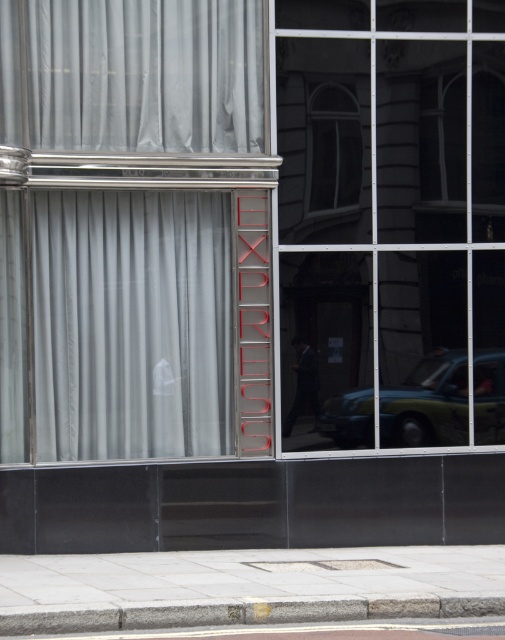
You are standing outside the building and want to see the interior through the windows. Which window, the transparent glass window at center or the clear glass window at center, allows you to see more of the interior due to its height?

The transparent glass window at center is much taller than the clear glass window at center, so it allows you to see more of the interior due to its height.

You are standing in front of the building and want to enter through the entrance that is to the right of the white sheer curtain at center. Is the entrance to the right or left of the gray concrete pavement at lower center?

The entrance is to the right of the gray concrete pavement at lower center because the white sheer curtain at center is to the left of the gray concrete pavement at lower center, so the entrance, being to the right of the curtain, would be positioned to the right of the pavement.